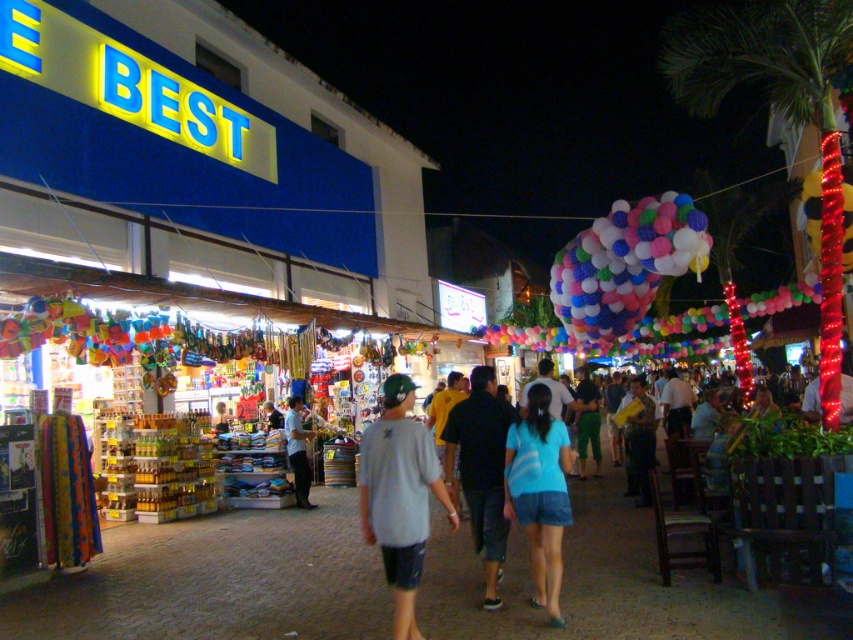
Can you confirm if light blue denim shorts at center is thinner than gray cotton shirt at center?

No.

Is light blue denim shorts at center to the right of gray cotton shirt at center from the viewer's perspective?

Correct, you'll find light blue denim shorts at center to the right of gray cotton shirt at center.

This screenshot has height=640, width=853. What do you see at coordinates (402, 493) in the screenshot?
I see `light blue denim shorts at center` at bounding box center [402, 493].

This screenshot has height=640, width=853. I want to click on light blue denim shorts at center, so click(x=402, y=493).

Which is behind, point (389, 486) or point (531, 509)?

Point (531, 509)

Who is shorter, gray cotton shirt at center or blue denim shorts at center?

With less height is blue denim shorts at center.

Is point (396, 618) positioned behind point (544, 602)?

No, (396, 618) is in front of (544, 602).

This screenshot has height=640, width=853. Find the location of `gray cotton shirt at center`. gray cotton shirt at center is located at coordinates [x=399, y=497].

Can you confirm if gray cotton shirt at center is positioned to the right of light blue t-shirt at center?

Correct, you'll find gray cotton shirt at center to the right of light blue t-shirt at center.

From the picture: Who is lower down, gray cotton shirt at center or light blue t-shirt at center?

Positioned lower is light blue t-shirt at center.

Identify the location of gray cotton shirt at center. This screenshot has height=640, width=853. (399, 497).

Where is `gray cotton shirt at center`? gray cotton shirt at center is located at coordinates (399, 497).